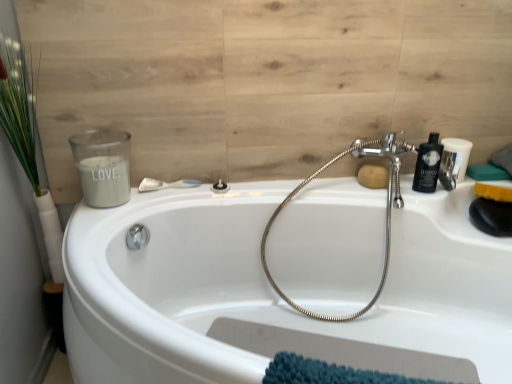
This screenshot has height=384, width=512. Describe the element at coordinates (428, 165) in the screenshot. I see `black plastic bottle at upper right` at that location.

What do you see at coordinates (283, 282) in the screenshot? This screenshot has width=512, height=384. I see `white glossy bathtub at center` at bounding box center [283, 282].

Identify the location of white glossy bathtub at center. (283, 282).

Where is `green leafy plant at left`? This screenshot has width=512, height=384. green leafy plant at left is located at coordinates (27, 143).

Image resolution: width=512 pixels, height=384 pixels. Identify the location of yellow sponge at right, which appears as the first soap when viewed from the right. (493, 192).

Measure the distance between white matte candle at upper left and camera.

The distance of white matte candle at upper left from camera is 4.40 feet.

Identify the location of white plastic shower at upper center, which is counted as the 1th shower, starting from the left. (166, 184).

Can you tell me how much black plastic bottle at upper right and chrome flexible hose at upper right differ in facing direction?

They differ by 0.0605 degrees in their facing directions.

Is black plastic bottle at upper right at the left side of chrome flexible hose at upper right?

No, black plastic bottle at upper right is not to the left of chrome flexible hose at upper right.

From a real-world perspective, does black plastic bottle at upper right stand above chrome flexible hose at upper right?

Correct, in the physical world, black plastic bottle at upper right is higher than chrome flexible hose at upper right.

Choose the correct answer: Is black plastic bottle at upper right inside chrome flexible hose at upper right or outside it?

The correct answer is: inside.

From a real-world perspective, does wooden panel at upper left stand above white glossy bathtub at center?

Yes.

From the picture: Is wooden panel at upper left taller or shorter than white glossy bathtub at center?

Considering their sizes, wooden panel at upper left has more height than white glossy bathtub at center.

Is wooden panel at upper left at the left side of white glossy bathtub at center?

Yes.

Are wooden panel at upper left and white glossy bathtub at center making contact?

They are not placed beside each other.

Who is smaller, white plastic shower at upper center, which is the second shower in right-to-left order, or matte black toiletry at upper right?

With smaller size is white plastic shower at upper center, which is the second shower in right-to-left order.

Is white plastic shower at upper center, which is the second shower in right-to-left order, oriented away from matte black toiletry at upper right?

No, white plastic shower at upper center, which is the second shower in right-to-left order,'s orientation is not away from matte black toiletry at upper right.

Does white plastic shower at upper center, which is counted as the 1th shower, starting from the left, have a lesser width compared to matte black toiletry at upper right?

Indeed, white plastic shower at upper center, which is counted as the 1th shower, starting from the left, has a lesser width compared to matte black toiletry at upper right.

Who is bigger, green leafy plant at left or matte black toiletry at upper right?

With larger size is green leafy plant at left.

Between point (32, 99) and point (458, 172), which one is positioned in front?

The point (32, 99) is closer.

Choose the correct answer: Is green leafy plant at left inside matte black toiletry at upper right or outside it?

green leafy plant at left is not enclosed by matte black toiletry at upper right.

From a real-world perspective, is white glossy bathtub at center under chrome flexible hose at upper right?

Yes, from a real-world perspective, white glossy bathtub at center is below chrome flexible hose at upper right.

Is white glossy bathtub at center bigger or smaller than chrome flexible hose at upper right?

white glossy bathtub at center is bigger than chrome flexible hose at upper right.

Considering the relative positions of white glossy bathtub at center and chrome flexible hose at upper right in the image provided, is white glossy bathtub at center in front of chrome flexible hose at upper right?

Yes, it is.

Would you say white glossy bathtub at center is inside or outside chrome flexible hose at upper right?

white glossy bathtub at center lies outside chrome flexible hose at upper right.

Is white plastic shower at upper center, which is counted as the 1th shower, starting from the left, taller or shorter than yellow sponge at right, arranged as the 2th soap when viewed from the left?

Considering their sizes, white plastic shower at upper center, which is counted as the 1th shower, starting from the left, has less height than yellow sponge at right, arranged as the 2th soap when viewed from the left.

Considering the positions of objects white plastic shower at upper center, which is the second shower in right-to-left order, and yellow sponge at right, arranged as the 2th soap when viewed from the left, in the image provided, who is more to the left, white plastic shower at upper center, which is the second shower in right-to-left order, or yellow sponge at right, arranged as the 2th soap when viewed from the left,?

white plastic shower at upper center, which is the second shower in right-to-left order, is more to the left.

Looking at the image, does white plastic shower at upper center, which is counted as the 1th shower, starting from the left, seem bigger or smaller compared to yellow sponge at right, arranged as the 2th soap when viewed from the left?

Clearly, white plastic shower at upper center, which is counted as the 1th shower, starting from the left, is smaller in size than yellow sponge at right, arranged as the 2th soap when viewed from the left.

Is brown matte soap at upper right, which is counted as the second soap, starting from the right, oriented towards white glossy bathtub at center?

Yes.

Considering the relative sizes of brown matte soap at upper right, the first soap viewed from the left, and white glossy bathtub at center in the image provided, is brown matte soap at upper right, the first soap viewed from the left, thinner than white glossy bathtub at center?

Yes, brown matte soap at upper right, the first soap viewed from the left, is thinner than white glossy bathtub at center.

Is white glossy bathtub at center inside brown matte soap at upper right, which is counted as the second soap, starting from the right?

No, brown matte soap at upper right, which is counted as the second soap, starting from the right, does not contain white glossy bathtub at center.

Locate an element on the screen. soap dispenser on the right side of chrome flexible hose at upper right is located at coordinates (428, 165).

You are a GUI agent. You are given a task and a screenshot of the screen. Output one action in this format:
    pyautogui.click(x=<x>, y=<y>)
    Task: Click on the plywood behind the white glossy bathtub at center
    
    Given the screenshot: What is the action you would take?
    pyautogui.click(x=264, y=81)

Which object lies nearer to the anchor point yellow sponge at right, which appears as the first soap when viewed from the right, matte black showerhead at center, the second shower from the left, or white matte candle at upper left?

The object closer to yellow sponge at right, which appears as the first soap when viewed from the right, is matte black showerhead at center, the second shower from the left.

Based on their spatial positions, is matte black toiletry at upper right or brown matte soap at upper right, which is counted as the second soap, starting from the right, further from black plastic bottle at upper right?

brown matte soap at upper right, which is counted as the second soap, starting from the right, is positioned further to the anchor black plastic bottle at upper right.

Which object lies nearer to the anchor point white matte candle at upper left, yellow sponge at right, which appears as the first soap when viewed from the right, or matte black showerhead at center, the second shower from the left?

matte black showerhead at center, the second shower from the left, is closer to white matte candle at upper left.

Based on the photo, when comparing their distances from matte black toiletry at upper right, does black plastic bottle at upper right or white plastic shower at upper center, which is the second shower in right-to-left order, seem further?

white plastic shower at upper center, which is the second shower in right-to-left order.

Based on their spatial positions, is brown matte soap at upper right, the first soap viewed from the left, or white glossy bathtub at center further from white matte candle at upper left?

Among the two, brown matte soap at upper right, the first soap viewed from the left, is located further to white matte candle at upper left.

Estimate the real-world distances between objects in this image. Which object is further from black plastic bottle at upper right, white glossy bathtub at center or white plastic shower at upper center, which is counted as the 1th shower, starting from the left?

white plastic shower at upper center, which is counted as the 1th shower, starting from the left, is positioned further to the anchor black plastic bottle at upper right.

When comparing their distances from green leafy plant at left, does chrome flexible hose at upper right or white matte candle at upper left seem closer?

white matte candle at upper left.

Consider the image. Estimate the real-world distances between objects in this image. Which object is further from matte black showerhead at center, the second shower from the left, yellow sponge at right, arranged as the 2th soap when viewed from the left, or white glossy bathtub at center?

Based on the image, yellow sponge at right, arranged as the 2th soap when viewed from the left, appears to be further to matte black showerhead at center, the second shower from the left.

Where is `soap between white glossy bathtub at center and matte black showerhead at center, which is counted as the 1th shower, starting from the right, from front to back`? soap between white glossy bathtub at center and matte black showerhead at center, which is counted as the 1th shower, starting from the right, from front to back is located at coordinates (493, 192).

Find the location of `plumbing fixture between matte black showerhead at center, the second shower from the left, and black plastic bottle at upper right from left to right`. plumbing fixture between matte black showerhead at center, the second shower from the left, and black plastic bottle at upper right from left to right is located at coordinates (386, 212).

Find the location of a particular element. The width and height of the screenshot is (512, 384). bathtub between white plastic shower at upper center, which is the second shower in right-to-left order, and yellow sponge at right, which appears as the first soap when viewed from the right is located at coordinates (283, 282).

Identify the location of plywood situated between white plastic shower at upper center, which is the second shower in right-to-left order, and matte black toiletry at upper right from left to right. The image size is (512, 384). (264, 81).